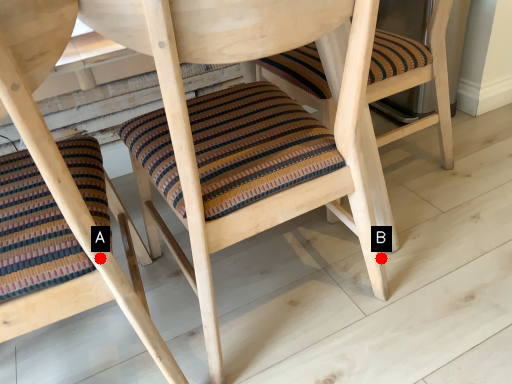
Question: Two points are circled on the image, labeled by A and B beside each circle. Which point is further to the camera?

Choices:
 (A) A is further
 (B) B is further

Answer: (B)